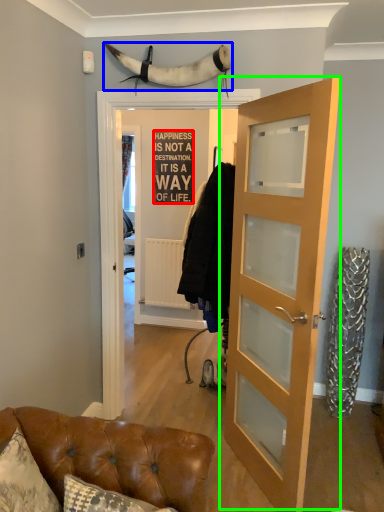
Question: Estimate the real-world distances between objects in this image. Which object is closer to writing (highlighted by a red box), animal (highlighted by a blue box) or door (highlighted by a green box)?

Choices:
 (A) animal
 (B) door

Answer: (A)